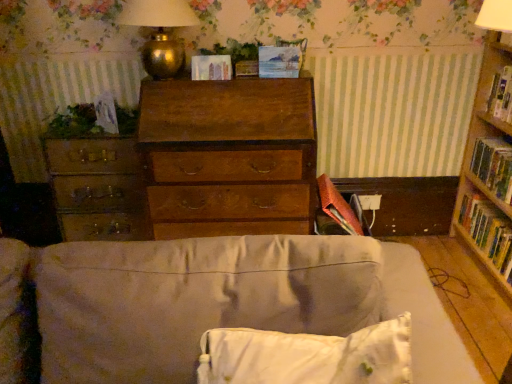
At what (x,y) coordinates should I click in order to perform the action: click on vacant region to the left of matte paper at center, positioned as the 3th paperback book in right-to-left order. Please return your answer as a coordinate pair (x, y). The image size is (512, 384). Looking at the image, I should click on (175, 79).